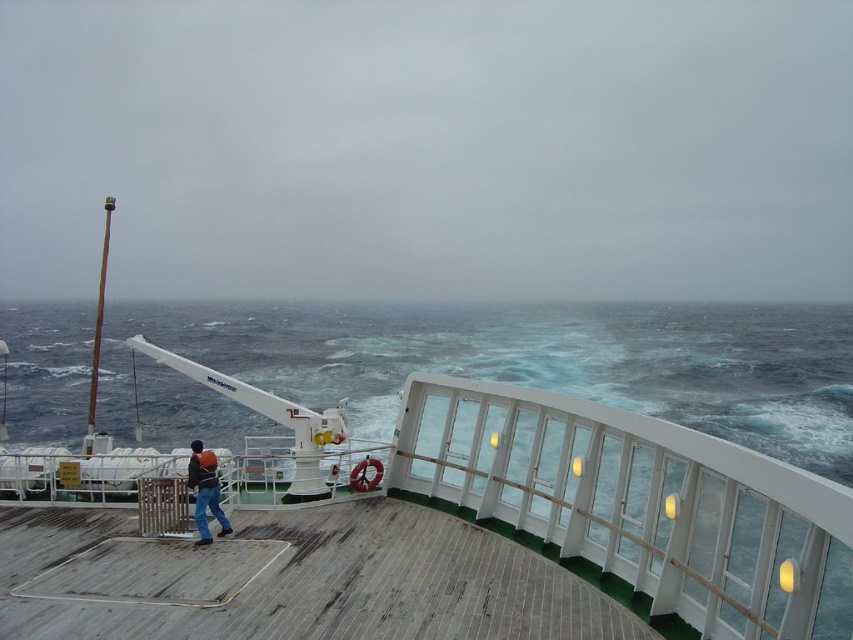
You are a crew member on the ship and need to move a heavy crate from the deck to the storage area. The white matte crane at upper left and the dark blue jeans at lower left are both in your line of sight. Which object can you use to lift the crate?

The white matte crane at upper left can be used to lift the crate because it is larger in size compared to the dark blue jeans at lower left, which are likely clothing and not functional for lifting heavy objects.